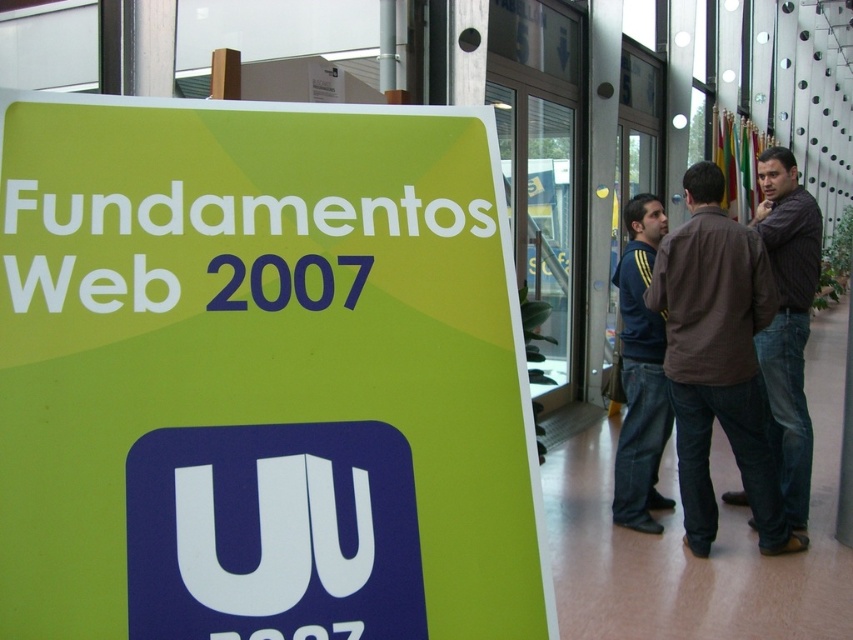
Consider the image. You are organizing a small event and need to place a decorative banner that is 1.2 meters wide. You have two options available from the scene described. Which object can accommodate the banner in terms of width? Please choose between the green paper sign at left and the dark blue jeans at center.

The green paper sign at left has a larger width than the dark blue jeans at center, so the banner can be placed on the green paper sign at left.

You are standing in the scene and want to approach the brown cotton shirt at right and the dark blue jeans at center. Which one should you move towards first to reach the closer one?

The brown cotton shirt at right is closer to the viewer than dark blue jeans at center, so you should move towards the brown cotton shirt at right first.

You are standing in the modern building and want to locate the green paper sign at left. According to the coordinates provided, where exactly should you look?

The green paper sign at left is located at the coordinates point [260,376].